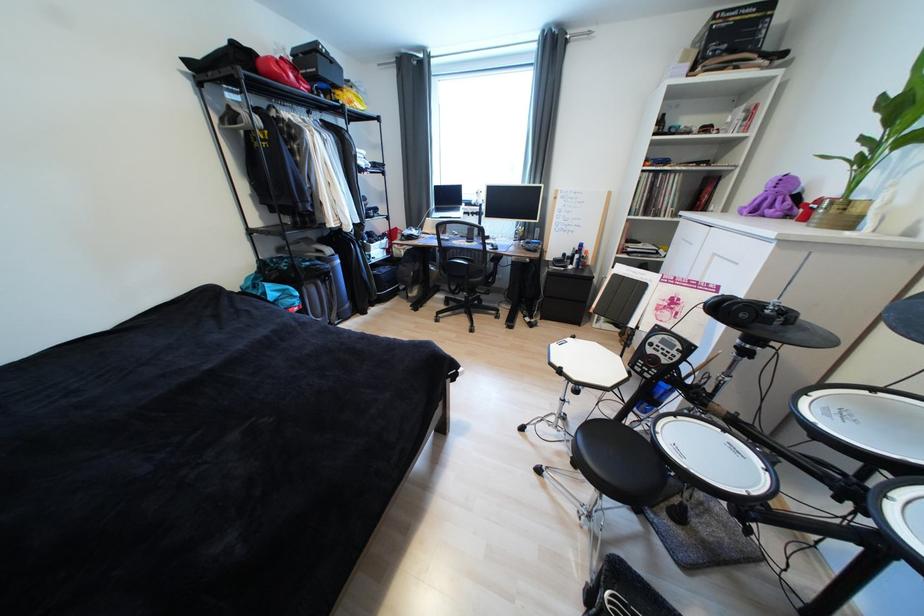
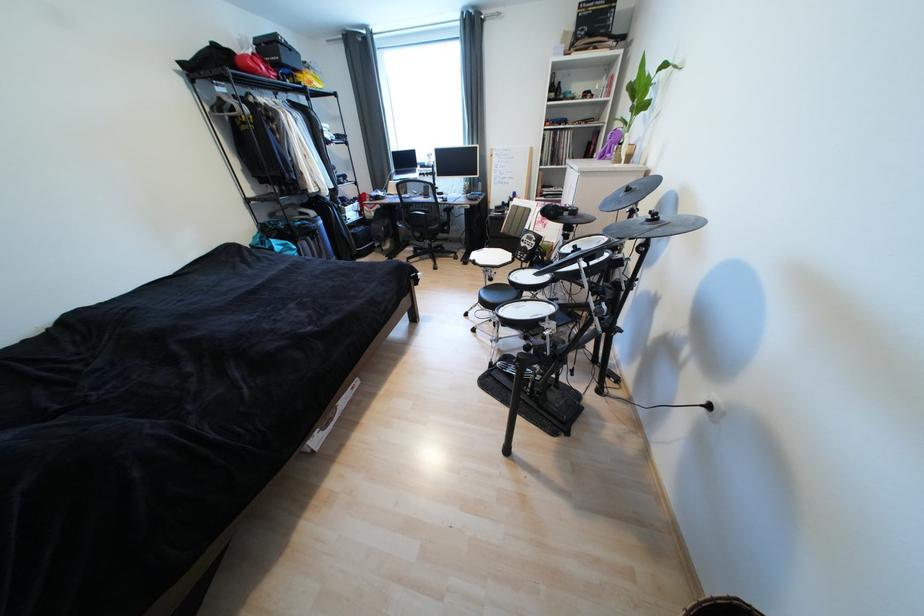
Locate, in the second image, the point that corresponds to point (499, 261) in the first image.

(452, 212)